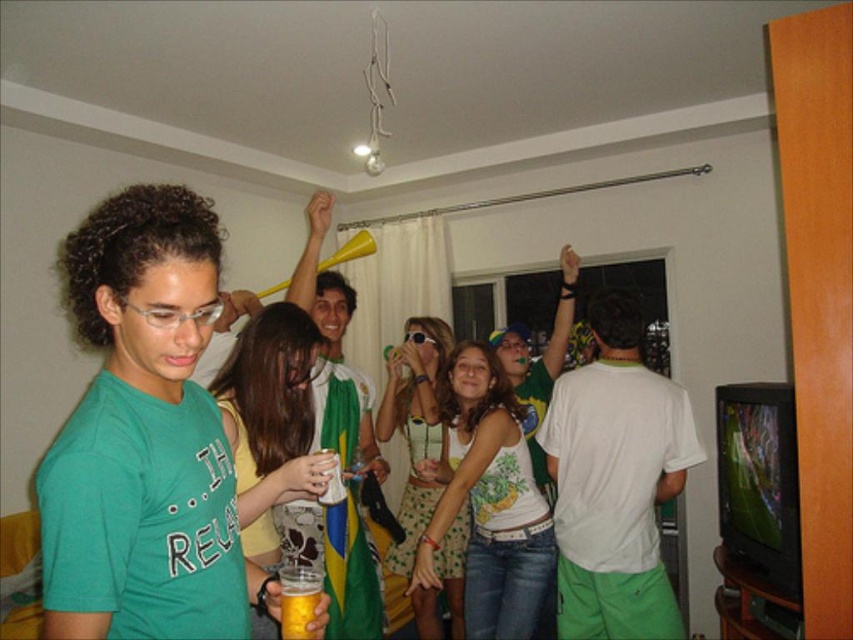
You are a guest at this event and want to grab a drink from the translucent plastic cup at lower left without moving the green polka dot dress at center. Is the cup within arm reach if you are standing next to the dress?

The distance between the green polka dot dress at center and the translucent plastic cup at lower left is 5.55 feet. Since arm reach is typically around 2 feet, the cup is out of reach unless you move closer.

You are at a party and want to pour a drink into one of the translucent plastic cups. Which cup will require more liquid to fill completely, the translucent plastic cup at center or the translucent plastic cup at lower left?

The translucent plastic cup at center has a greater height compared to the translucent plastic cup at lower left, so it will require more liquid to fill completely.